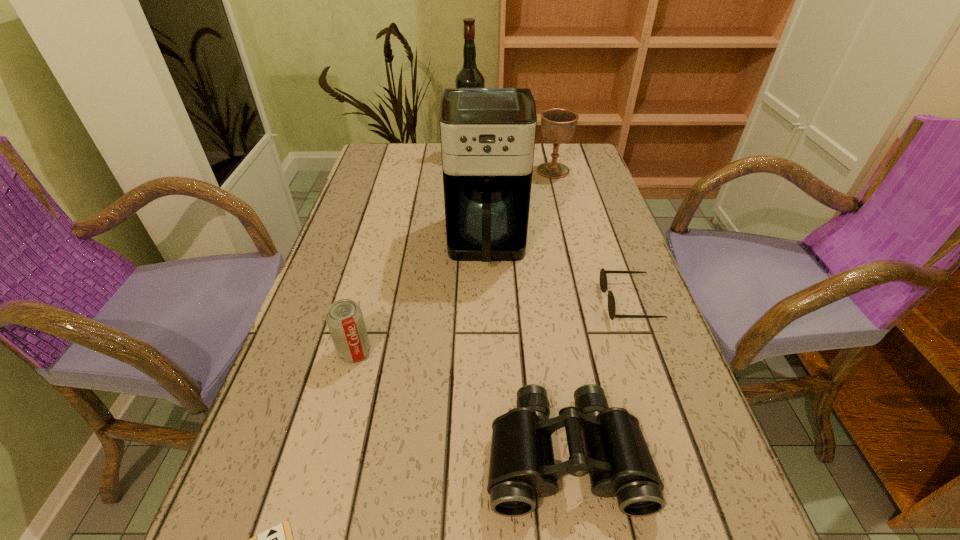
Locate an element on the screen. chalice that is positioned at the right edge is located at coordinates (558, 125).

The image size is (960, 540). I want to click on binoculars at the right edge, so [x=522, y=466].

This screenshot has width=960, height=540. In order to click on sunglasses that is at the right edge in this screenshot , I will do `click(603, 277)`.

Where is `object present at the far right corner`? This screenshot has width=960, height=540. object present at the far right corner is located at coordinates (558, 125).

Image resolution: width=960 pixels, height=540 pixels. I want to click on free spot at the far edge of the desktop, so pyautogui.click(x=438, y=166).

You are a GUI agent. You are given a task and a screenshot of the screen. Output one action in this format:
    pyautogui.click(x=<x>, y=<y>)
    Task: Click on the vacant region at the left edge of the desktop
    The image size is (960, 540).
    Given the screenshot: What is the action you would take?
    pyautogui.click(x=339, y=227)

Identify the location of free region at the right edge. (576, 262).

Locate an element on the screen. free location at the far left corner is located at coordinates (411, 155).

Where is `vacant space at the far right corner`? vacant space at the far right corner is located at coordinates (565, 165).

You are a GUI agent. You are given a task and a screenshot of the screen. Output one action in this format:
    pyautogui.click(x=<x>, y=<y>)
    Task: Click on the vacant region between the binoculars and the second shortest object
    
    Given the screenshot: What is the action you would take?
    pyautogui.click(x=597, y=379)